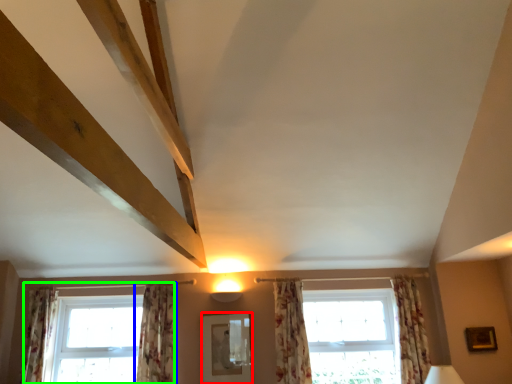
Question: Which object is positioned closest to mirror (highlighted by a red box)? Select from curtain (highlighted by a blue box) and window (highlighted by a green box).

Choices:
 (A) curtain
 (B) window

Answer: (A)